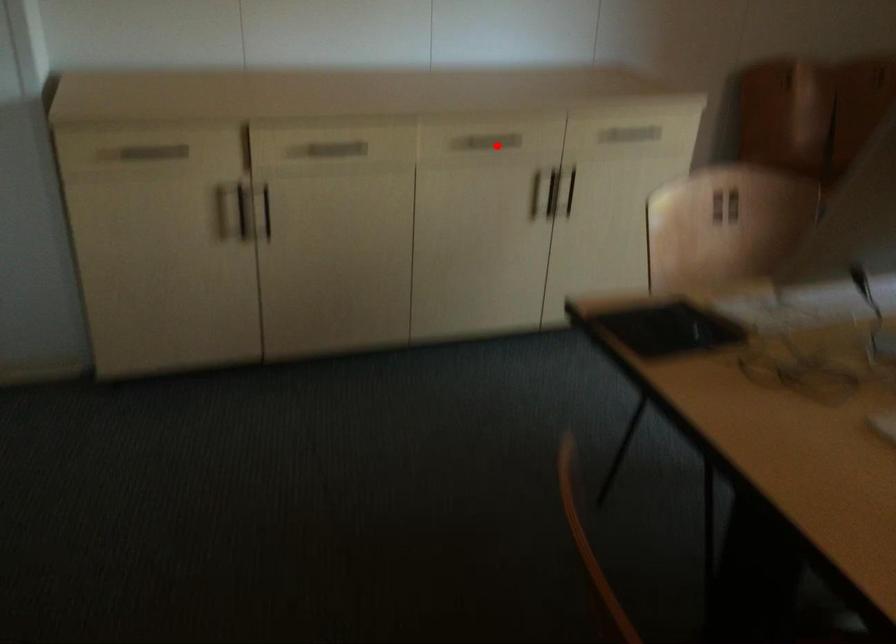
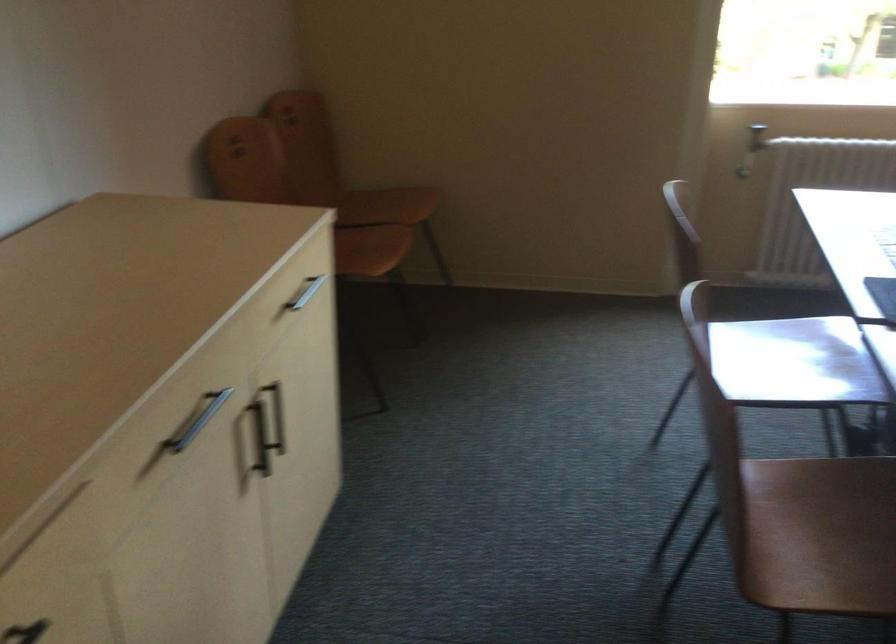
Locate, in the second image, the point that corresponds to the highlighted location in the first image.

(197, 420)